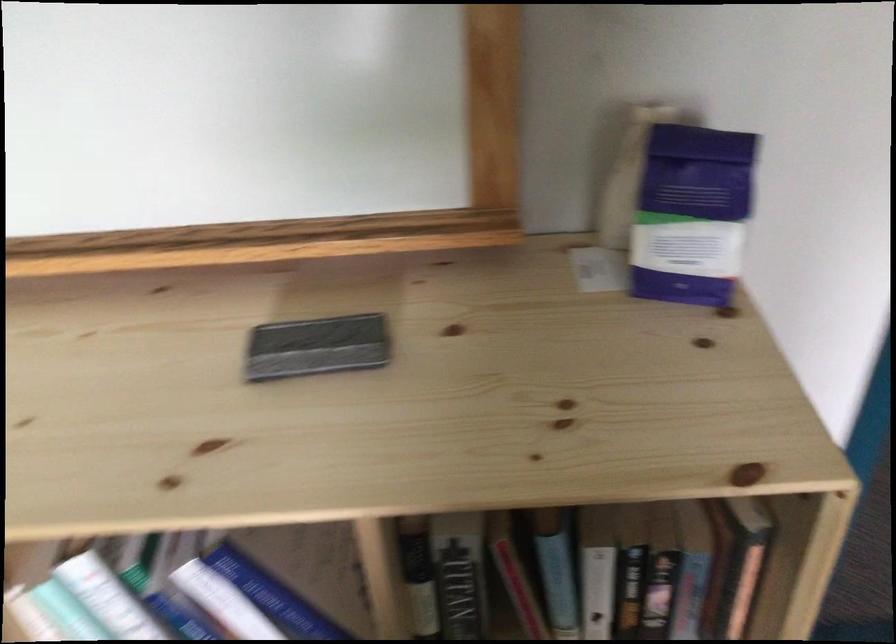
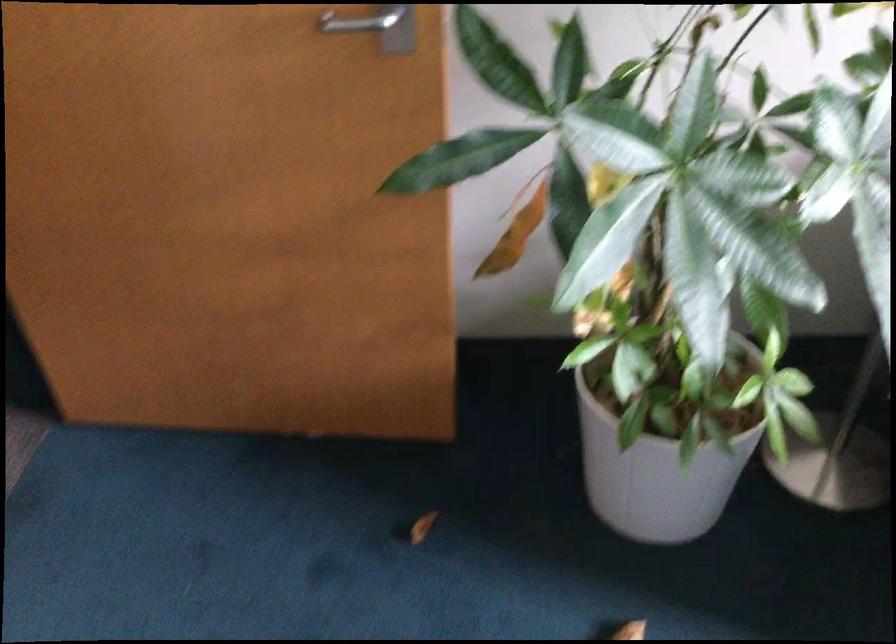
The first image is from the beginning of the video and the second image is from the end. How did the camera likely rotate when shooting the video?

The camera rotated toward right-down.